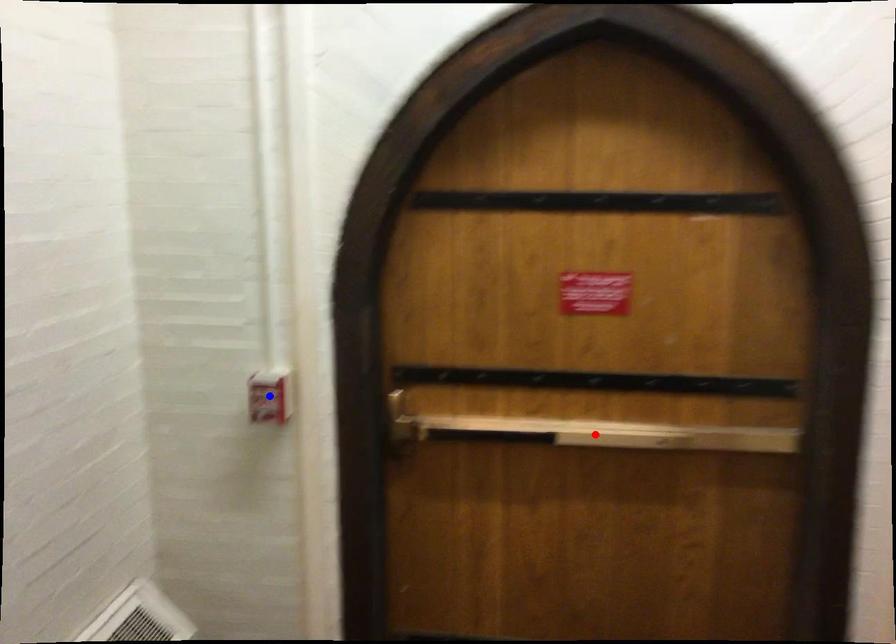
Question: Which of the two points in the image is closer to the camera?

Choices:
 (A) Blue point is closer.
 (B) Red point is closer.

Answer: (A)